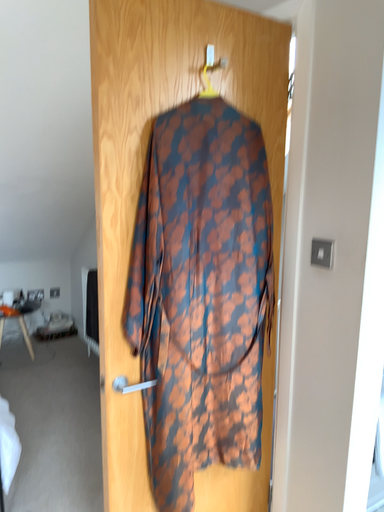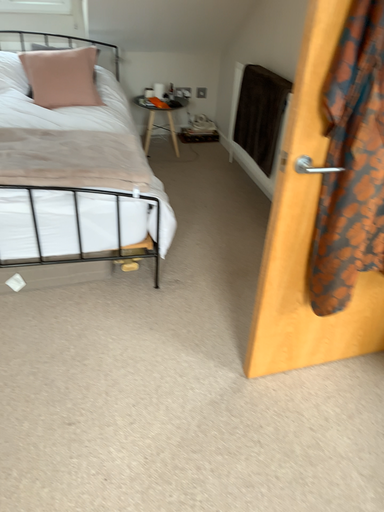
Question: Which way did the camera rotate in the video?

Choices:
 (A) rotated downward
 (B) rotated upward

Answer: (A)